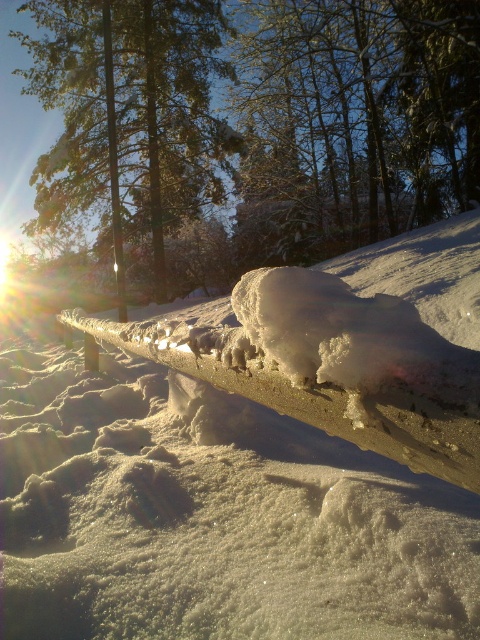
You are standing at the snow covered ground in the winter scene. You see two points marked on the image. The first point is at coordinate point (187, 486) and the second is at point (40, 20). Which point is closer to you?

Point (187, 486) is in front of point (40, 20), so the first point is closer to you.